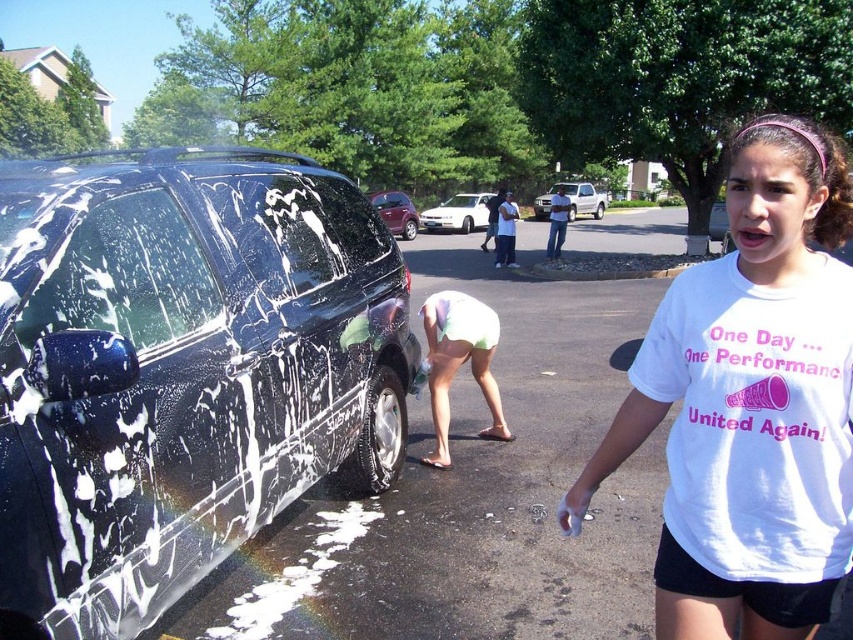
Consider the image. You are a photographer trying to capture the person in the light green shorts at lower center. If you want to frame them in your shot, where should you position your camera relative to the SUV?

To frame the person in the light green shorts at lower center, position the camera near the lower center area of the SUV since that is where the shorts are located.

You are a photographer standing at the edge of the car wash area. You want to take a photo that includes both the white matte truck at center and the shiny red car at center. Which vehicle should you position closer to the left side of your camera frame to ensure both are visible?

The white matte truck at center is positioned on the right side of the shiny red car at center. To include both in the photo, you should position the shiny red car at center closer to the left side of the camera frame so that the white matte truck at center naturally falls on the right side without going out of frame.

You are a photographer trying to capture the car wash scene. You want to take a photo that includes both the white glossy car at center and the white matte truck at center. Based on their positions, which one should you focus on first to ensure both are in frame?

The white glossy car at center is below the white matte truck at center, so you should focus on the white matte truck at center first to ensure both are in frame.